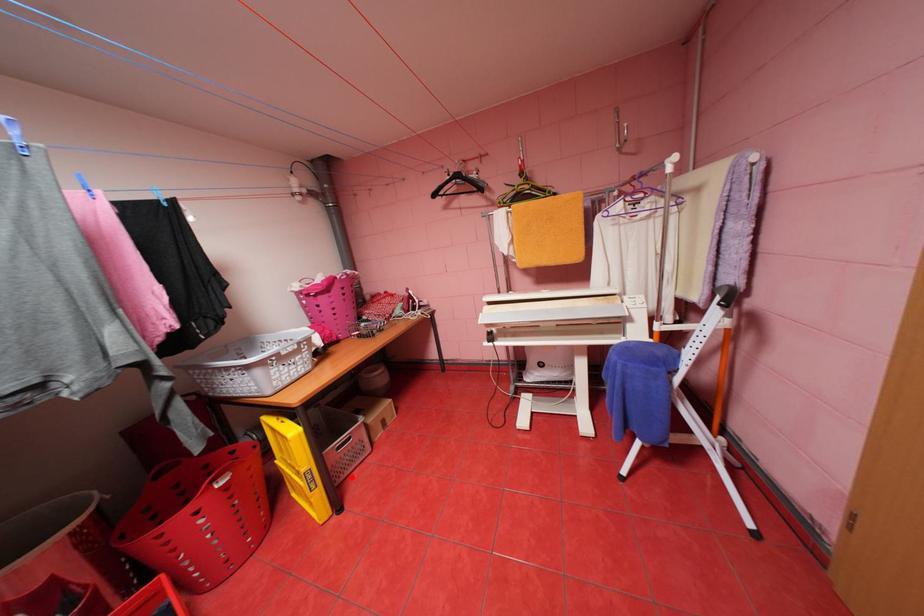
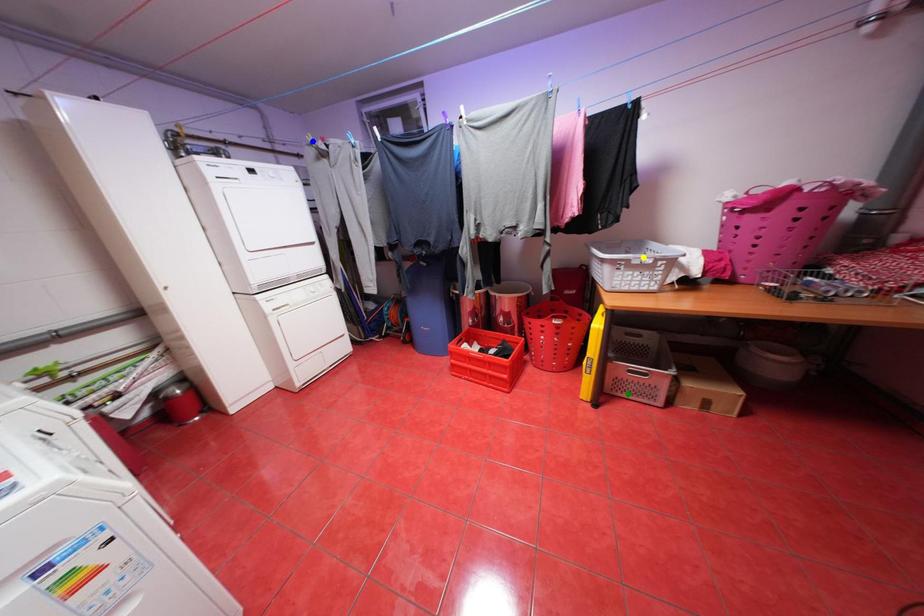
Question: I am providing you with two images of the same scene from different viewpoints. A red point is marked on the first image. You are given multiple points on the second image. Which point in image 2 is actually the same real-world point as the red point in image 1?

Choices:
 (A) blue point
 (B) green point
 (C) yellow point

Answer: (B)